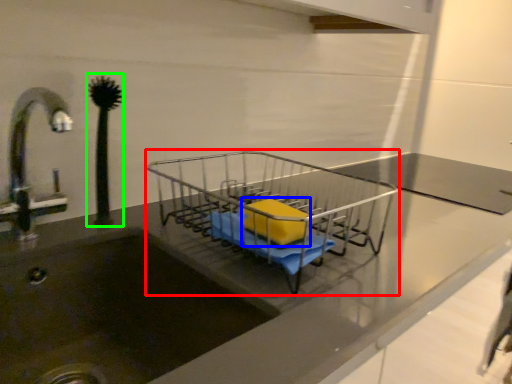
Question: Based on their relative distances, which object is nearer to trolley (highlighted by a red box)? Choose from material (highlighted by a blue box) and plant (highlighted by a green box).

Choices:
 (A) material
 (B) plant

Answer: (A)